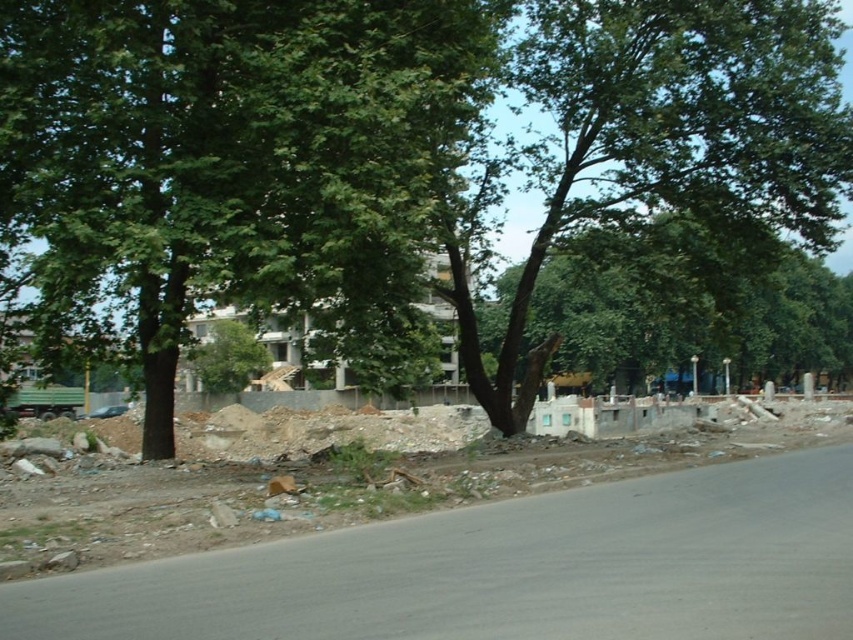
Question: Which point is closer to the camera taking this photo?

Choices:
 (A) tap(511, 556)
 (B) tap(514, 253)

Answer: (A)

Question: Among these points, which one is nearest to the camera?

Choices:
 (A) (323, 612)
 (B) (520, 248)

Answer: (A)

Question: Does concrete rubble at center have a lesser width compared to green leafy tree at upper left?

Choices:
 (A) no
 (B) yes

Answer: (B)

Question: Can you confirm if concrete rubble at center is positioned to the left of green leafy tree at upper left?

Choices:
 (A) no
 (B) yes

Answer: (B)

Question: Does concrete rubble at center appear on the left side of green leafy tree at upper left?

Choices:
 (A) no
 (B) yes

Answer: (B)